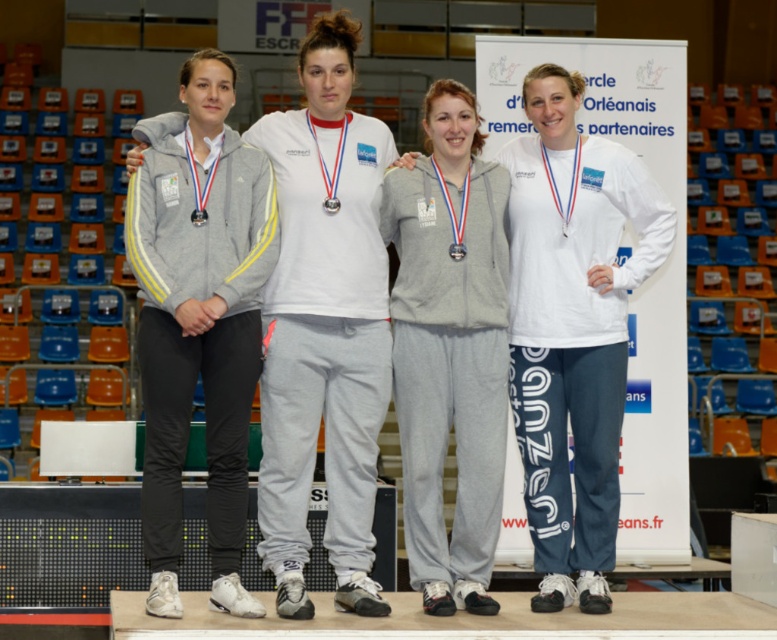
Can you confirm if gray fleece sweatshirt at center is positioned above gray heathered tracksuit at center?

Correct, gray fleece sweatshirt at center is located above gray heathered tracksuit at center.

The image size is (777, 640). Describe the element at coordinates (572, 326) in the screenshot. I see `gray fleece sweatshirt at center` at that location.

At what (x,y) coordinates should I click in order to perform the action: click on gray fleece sweatshirt at center. Please return your answer as a coordinate pair (x, y). Image resolution: width=777 pixels, height=640 pixels. Looking at the image, I should click on (572, 326).

Identify the location of gray fleece sweatshirt at center. (572, 326).

Is gray heathered tracksuit at center below metallic silver medal at center?

Correct, gray heathered tracksuit at center is located below metallic silver medal at center.

Who is higher up, gray heathered tracksuit at center or metallic silver medal at center?

metallic silver medal at center is higher up.

Between point (478, 136) and point (457, 259), which one is positioned behind?

The point (478, 136) is behind.

At what (x,y) coordinates should I click in order to perform the action: click on gray heathered tracksuit at center. Please return your answer as a coordinate pair (x, y). Looking at the image, I should click on (448, 348).

Is gray fleece sweatshirt at center below metallic silver medal at center?

Indeed, gray fleece sweatshirt at center is positioned under metallic silver medal at center.

What are the coordinates of `gray fleece sweatshirt at center` in the screenshot? It's located at (572, 326).